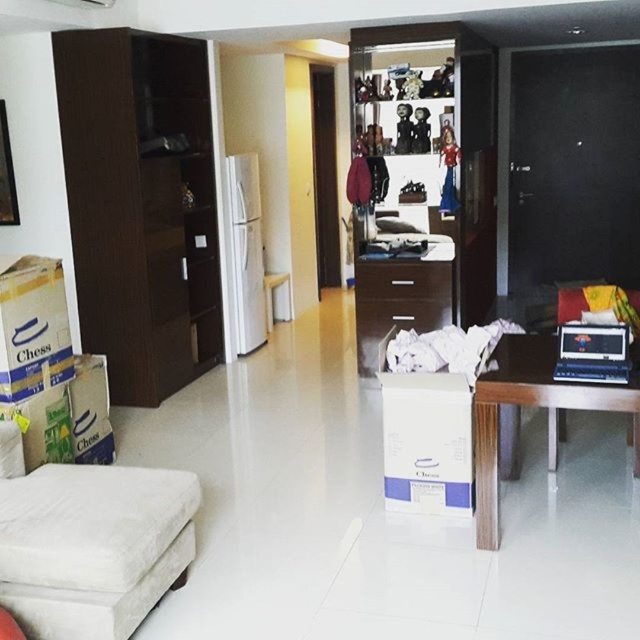
Question: Among these objects, which one is nearest to the camera?

Choices:
 (A) white fabric ottoman at lower left
 (B) dark wood drawer at center
 (C) white cardboard box at lower left
 (D) wooden drawer at center

Answer: (A)

Question: Is white cardboard box at lower left above dark wood drawer at center?

Choices:
 (A) yes
 (B) no

Answer: (B)

Question: Can you confirm if white fabric ottoman at lower left is positioned below dark wood drawer at center?

Choices:
 (A) no
 (B) yes

Answer: (B)

Question: Which point is farther to the camera?

Choices:
 (A) (362, 301)
 (B) (109, 310)
 (C) (477, 518)

Answer: (A)

Question: Which object appears farthest from the camera in this image?

Choices:
 (A) white cardboard box at lower left
 (B) white fabric ottoman at lower left
 (C) wooden wardrobe at center

Answer: (C)

Question: Can you confirm if dark wood cabinet at left is positioned to the left of white cardboard box at lower left?

Choices:
 (A) no
 (B) yes

Answer: (A)